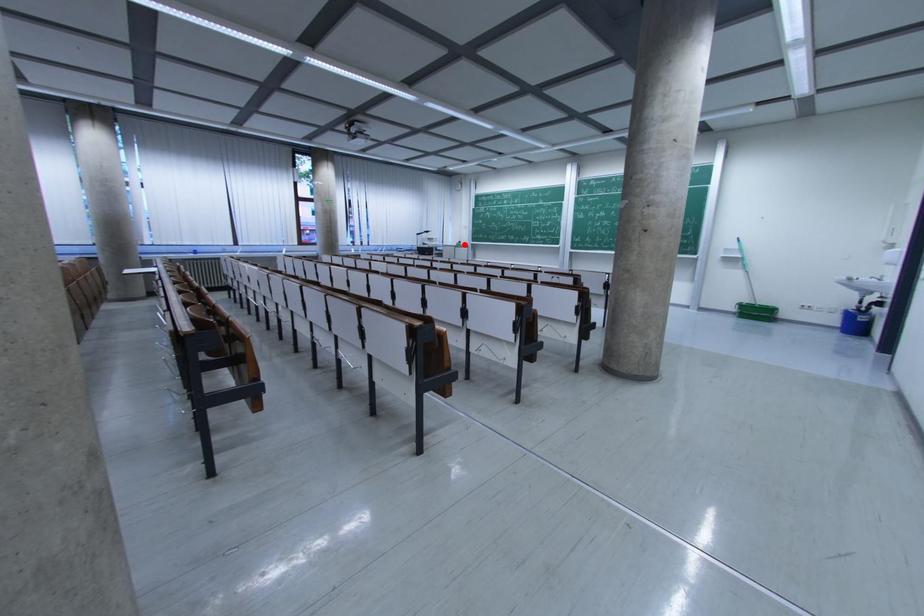
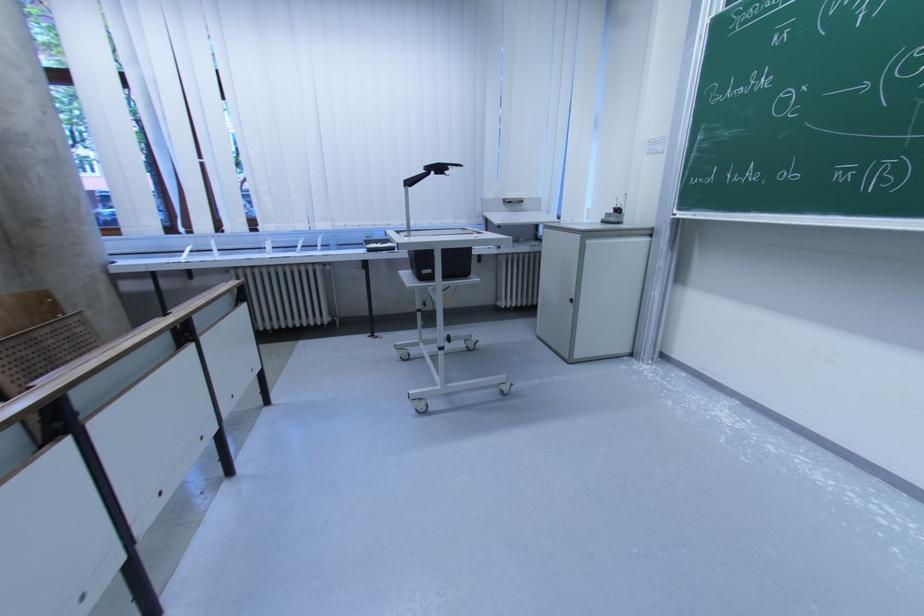
Question: I am providing you with two images of the same scene from different viewpoints. A red point is shown in image1. For the corresponding object point in image2, is it positioned nearer or farther from the camera?

Choices:
 (A) Nearer
 (B) Farther

Answer: (B)